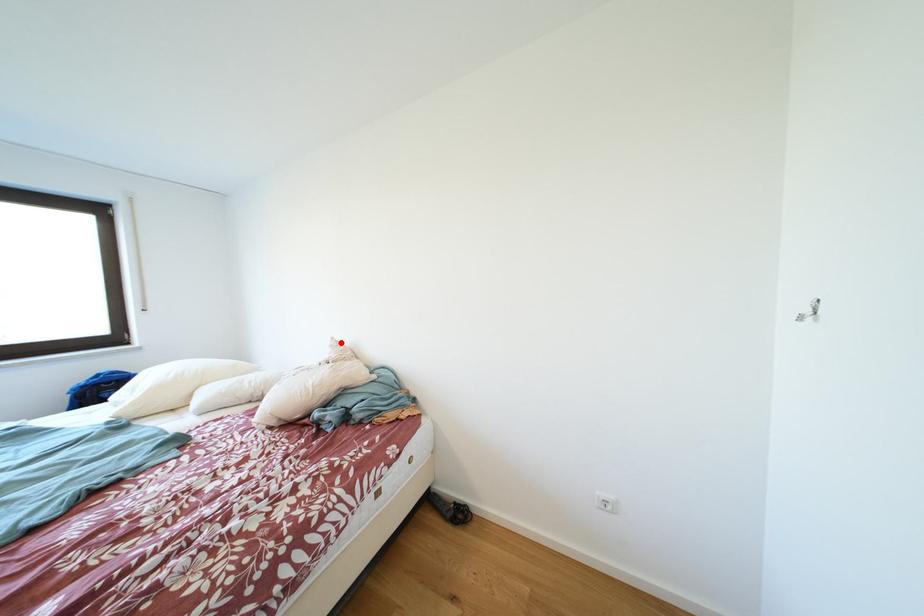
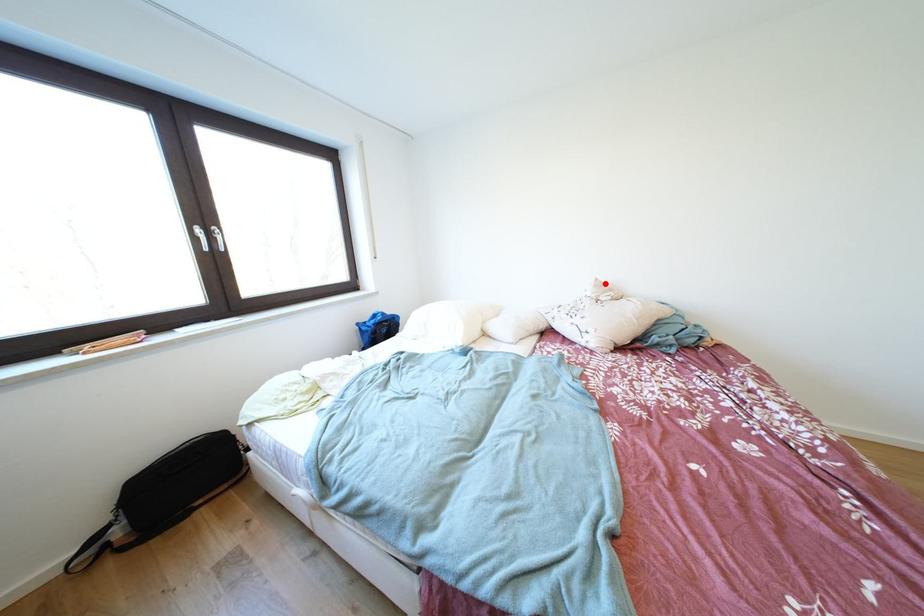
I am providing you with two images of the same scene from different viewpoints. A red point is marked on the first image and another point is marked on the second image. Is the marked point in image1 the same physical position as the marked point in image2?

Yes